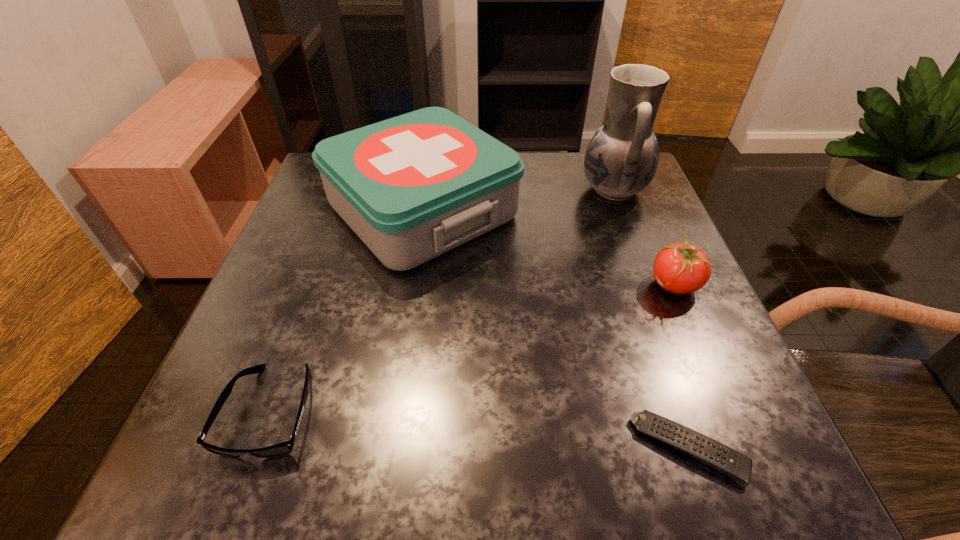
Select which object appears as the fourth closest to the tomato. Please provide its 2D coordinates. Your answer should be formatted as a tuple, i.e. [(x, y)], where the tuple contains the x and y coordinates of a point satisfying the conditions above.

[(284, 448)]

Image resolution: width=960 pixels, height=540 pixels. What are the coordinates of `the third closest object to the fourth tallest object` in the screenshot? It's located at (681, 268).

At what (x,y) coordinates should I click in order to perform the action: click on free location that satisfies the following two spatial constraints: 1. on the front-facing side of the tallest object; 2. on the front-facing side of the sunglasses. Please return your answer as a coordinate pair (x, y). The image size is (960, 540). Looking at the image, I should click on (697, 411).

The height and width of the screenshot is (540, 960). I want to click on blank space that satisfies the following two spatial constraints: 1. on the front side of the third tallest object; 2. on the left side of the first-aid kit, so click(411, 285).

Locate an element on the screen. free space in the image that satisfies the following two spatial constraints: 1. on the front side of the fourth shortest object; 2. on the left side of the remote control is located at coordinates (386, 449).

The image size is (960, 540). Identify the location of blank space that satisfies the following two spatial constraints: 1. on the back side of the tomato; 2. on the front-facing side of the tallest object. (633, 190).

I want to click on vacant region that satisfies the following two spatial constraints: 1. on the front-facing side of the pitcher; 2. on the front-facing side of the sunglasses, so click(697, 411).

Locate an element on the screen. Image resolution: width=960 pixels, height=540 pixels. blank space that satisfies the following two spatial constraints: 1. on the front-facing side of the tallest object; 2. on the back side of the tomato is located at coordinates (650, 285).

What are the coordinates of `free region that satisfies the following two spatial constraints: 1. on the front-facing side of the remote control; 2. on the right side of the second shortest object` in the screenshot? It's located at (256, 449).

I want to click on vacant space that satisfies the following two spatial constraints: 1. on the front-facing side of the pitcher; 2. on the right side of the tomato, so click(x=650, y=285).